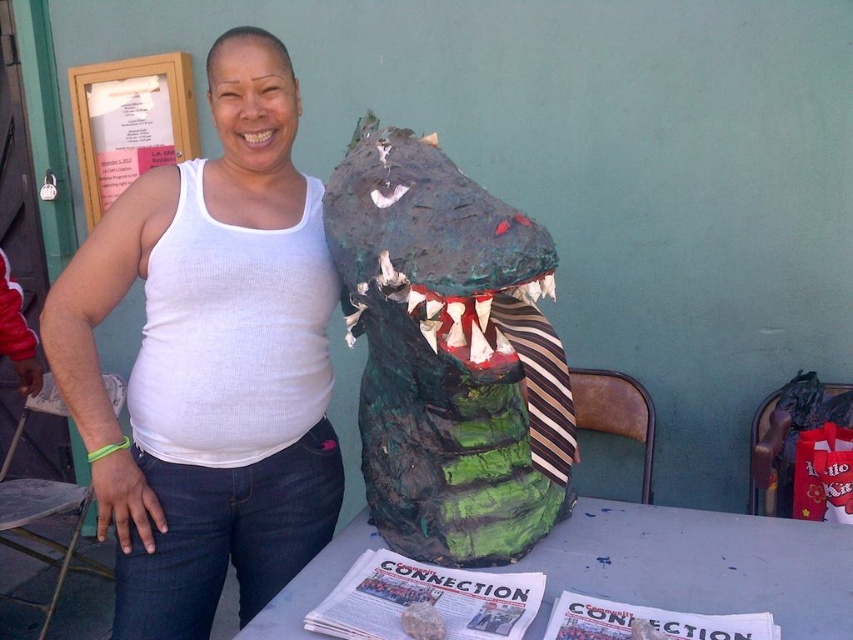
You are an artist preparing to display your work. You have a white paper at center and a wooden frame at upper left. Which object should you choose if you want to use the larger one for your next project?

The wooden frame at upper left is larger than the white paper at center, so you should choose the wooden frame at upper left.

You are a photographer at a community event and need to capture a closeup shot of the white fabric tank top at center and the white paper at center. The camera you are using has a minimum focusing distance of 25 inches. Can you take the photo without moving either object?

The white fabric tank top at center is 30.00 inches away from the white paper at center. Since the minimum focusing distance is 25 inches, you can take the photo without moving either object because the distance between them is within the camera range.

You are setting up a photo shoot and need to ensure proper lighting. The camera is positioned at the center of the scene. Which object, the white fabric tank top at center or the wooden frame at upper left, is closer to the camera?

The white fabric tank top at center is closer to the camera since it is located at the center, while the wooden frame at upper left is positioned further away. According to the description, they are 5.09 feet apart, so the tank top is nearer.